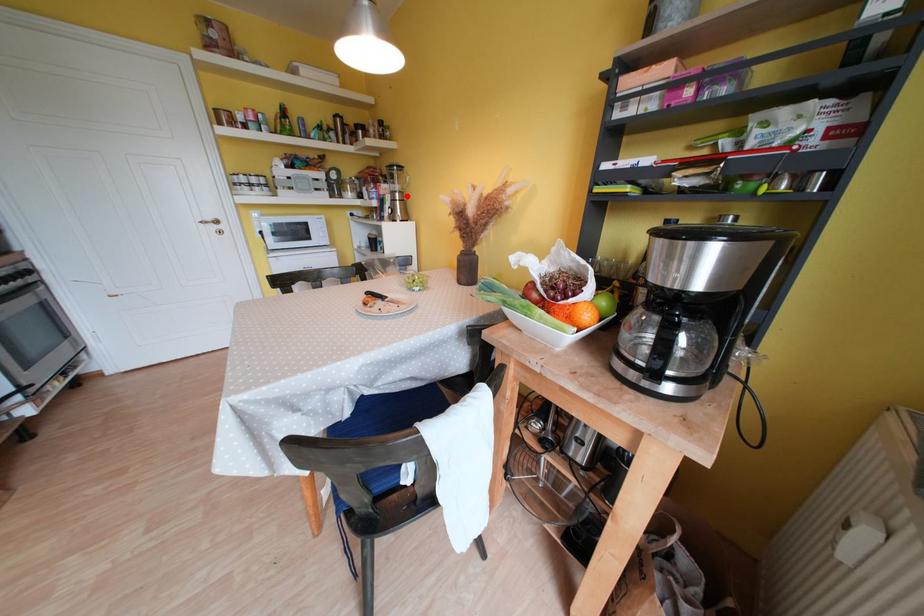
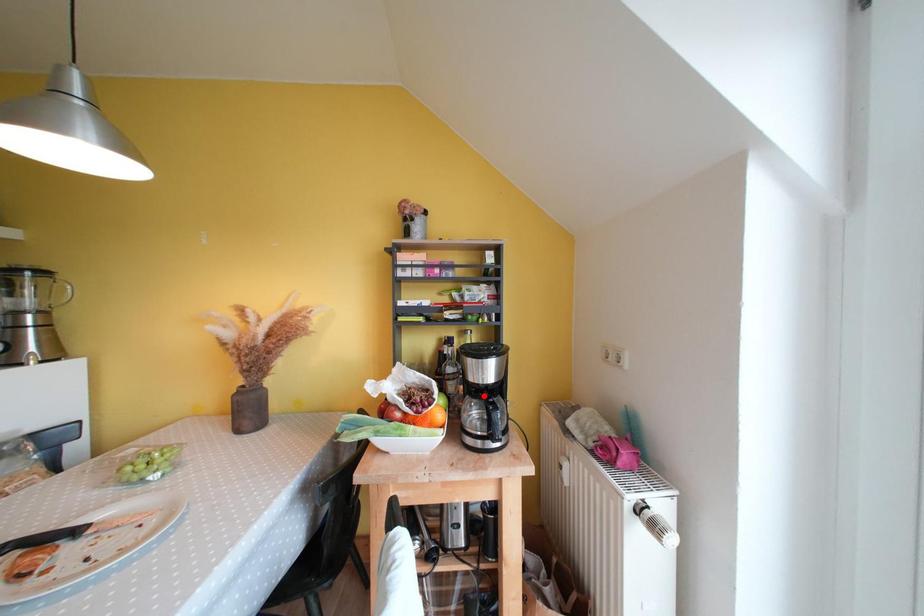
I am providing you with two images of the same scene from different viewpoints. A red point is marked on the first image and another point is marked on the second image. Is the red point in image1 aligned with the point shown in image2?

No